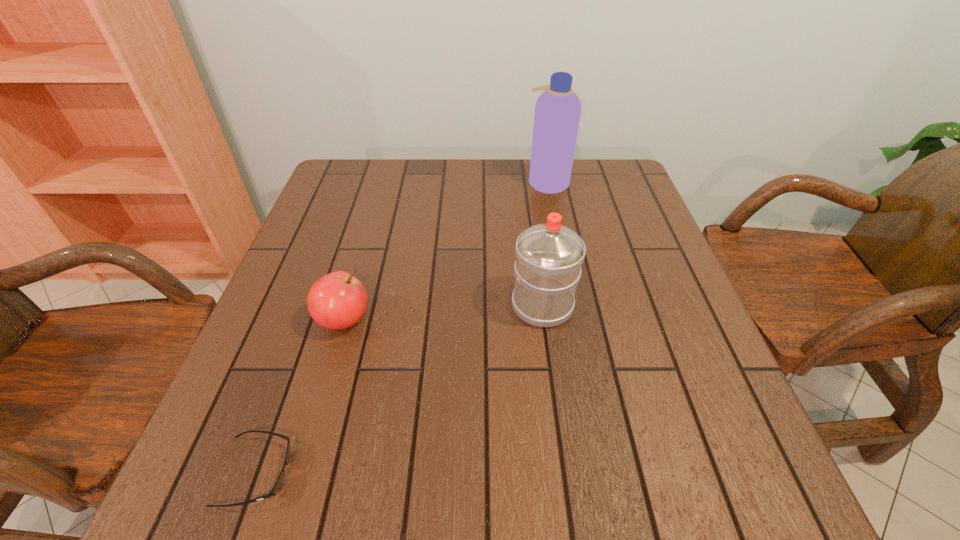
Where is `vacant space that's between the apple and the nearest object`? This screenshot has width=960, height=540. vacant space that's between the apple and the nearest object is located at coordinates (300, 396).

Identify which object is the nearest to the farthest object. Please provide its 2D coordinates. Your answer should be formatted as a tuple, i.e. [(x, y)], where the tuple contains the x and y coordinates of a point satisfying the conditions above.

[(549, 256)]

This screenshot has width=960, height=540. In order to click on the third closest object to the sunglasses in this screenshot , I will do `click(557, 111)`.

I want to click on free space that satisfies the following two spatial constraints: 1. on the handle side of the tallest object; 2. on the left side of the second tallest object, so (525, 181).

You are a GUI agent. You are given a task and a screenshot of the screen. Output one action in this format:
    pyautogui.click(x=<x>, y=<y>)
    Task: Click on the free region that satisfies the following two spatial constraints: 1. on the handle side of the water bottle; 2. on the right side of the tallest object
    This screenshot has width=960, height=540.
    Given the screenshot: What is the action you would take?
    pyautogui.click(x=525, y=181)

This screenshot has width=960, height=540. In order to click on vacant area in the image that satisfies the following two spatial constraints: 1. on the handle side of the third shortest object; 2. on the left side of the tallest object in this screenshot , I will do `click(525, 181)`.